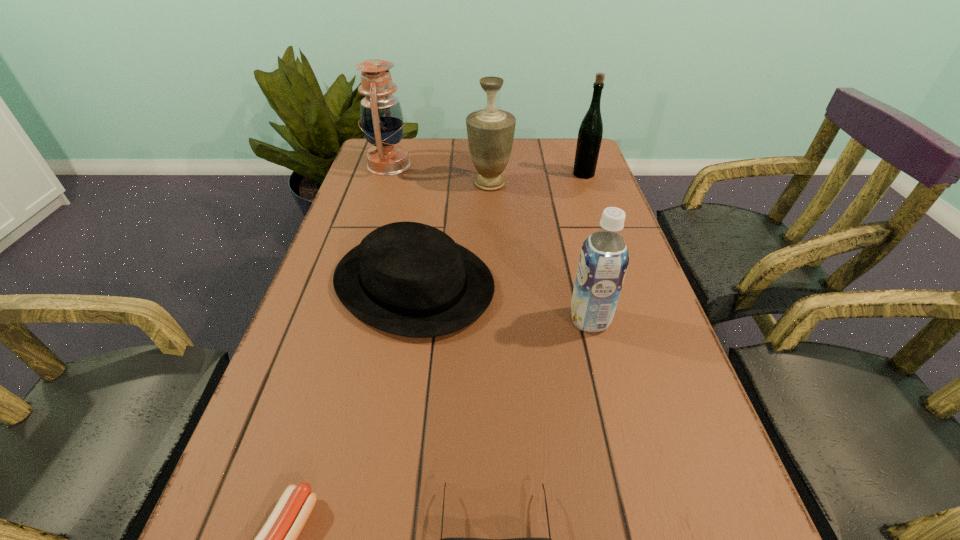
Image resolution: width=960 pixels, height=540 pixels. What are the coordinates of `object that is at the far right corner` in the screenshot? It's located at (590, 133).

The image size is (960, 540). Identify the location of vacant space at the far edge of the desktop. (537, 149).

Where is `vacant space at the left edge of the desktop`? vacant space at the left edge of the desktop is located at coordinates (328, 244).

The width and height of the screenshot is (960, 540). Find the location of `free region at the right edge`. free region at the right edge is located at coordinates (666, 421).

Where is `free space between the beer bottle and the urn`? free space between the beer bottle and the urn is located at coordinates (537, 179).

This screenshot has height=540, width=960. In order to click on vacant region between the fedora and the soya milk in this screenshot , I will do `click(502, 301)`.

The height and width of the screenshot is (540, 960). Find the location of `vacant area that lies between the sixth object from left to right and the fedora`. vacant area that lies between the sixth object from left to right and the fedora is located at coordinates (502, 301).

Identify the location of blank region between the beer bottle and the third shortest object. This screenshot has height=540, width=960. (499, 228).

Where is `vacant region between the second object from right to left and the oil lamp`? vacant region between the second object from right to left and the oil lamp is located at coordinates (489, 242).

Where is `empty space between the fifth tallest object and the rightmost object`? The width and height of the screenshot is (960, 540). empty space between the fifth tallest object and the rightmost object is located at coordinates (499, 228).